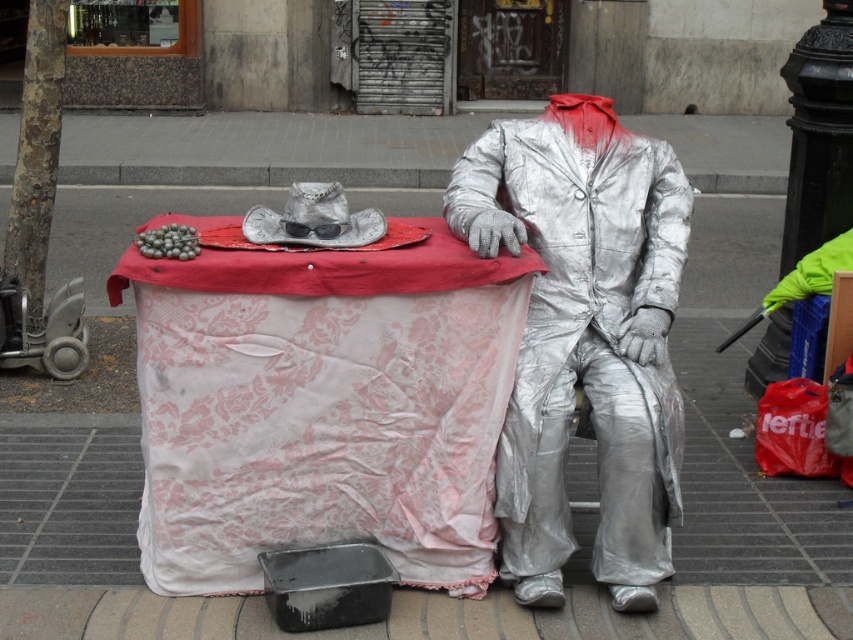
You are a street performer who wants to place a large prop on the pink lace table at center and the shiny metallic suit at center. Which object has enough space to accommodate the prop?

The pink lace table at center has a greater width than the shiny metallic suit at center, so it can accommodate the large prop.

You are a street performer who wants to place a new decorative item on the table. Given the sizes of the pink lace table at center and the shiny metallic suit at center, which object can accommodate a larger item?

The pink lace table at center is larger in size than the shiny metallic suit at center, so the pink lace table at center can accommodate a larger item.

You are a passerby on the sidewalk and want to place a tip in the black rectangular container. The shiny metallic suit at center is blocking your view of the container. Which direction should you walk to see the black rectangular container that is in front of the pink lace table at center?

The pink lace table at center is below the shiny metallic suit at center, so the shiny metallic suit is above the table. To see the black rectangular container in front of the pink lace table at center, you should walk around to the front side of the shiny metallic suit at center where the container is located.